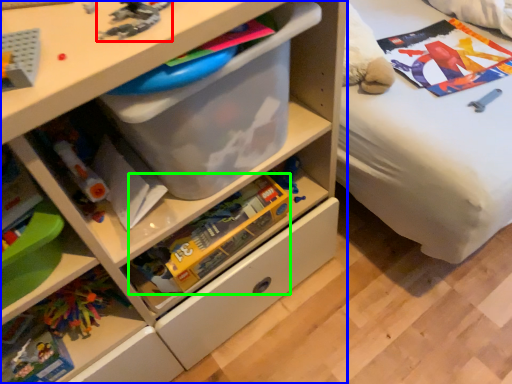
Question: Considering the real-world distances, which object is closest to toy (highlighted by a red box)? chest of drawers (highlighted by a blue box) or toy (highlighted by a green box).

Choices:
 (A) chest of drawers
 (B) toy

Answer: (A)